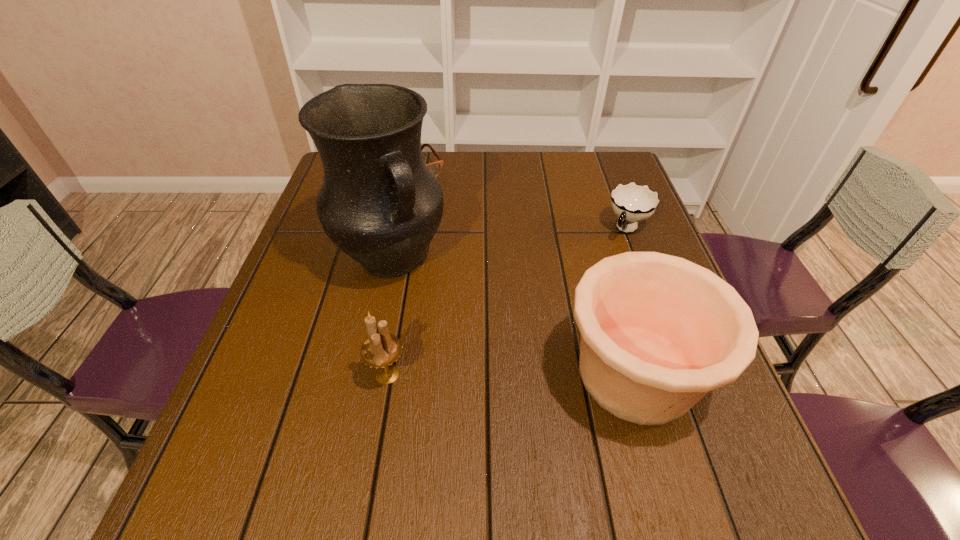
Locate an element on the screen. candle holder is located at coordinates (381, 349).

This screenshot has width=960, height=540. Identify the location of pottery. (658, 332).

Locate an element on the screen. Image resolution: width=960 pixels, height=540 pixels. the farthest object is located at coordinates (435, 167).

You are a GUI agent. You are given a task and a screenshot of the screen. Output one action in this format:
    pyautogui.click(x=<x>, y=<y>)
    Task: Click on the shortest object
    The height and width of the screenshot is (540, 960).
    Given the screenshot: What is the action you would take?
    pyautogui.click(x=435, y=167)

Locate an element on the screen. The height and width of the screenshot is (540, 960). the fourth tallest object is located at coordinates (632, 203).

Identify the location of the tallest object. This screenshot has width=960, height=540. (379, 203).

The image size is (960, 540). What are the coordinates of `free region located 0.330m on the right of the candle holder` in the screenshot? It's located at (580, 374).

Find the location of a particular element. The height and width of the screenshot is (540, 960). vacant space located on the left of the pottery is located at coordinates (530, 373).

This screenshot has height=540, width=960. I want to click on free location located 0.070m on the front-facing side of the farthest object, so click(x=429, y=200).

Image resolution: width=960 pixels, height=540 pixels. I want to click on free location located on the front-facing side of the farthest object, so click(x=464, y=260).